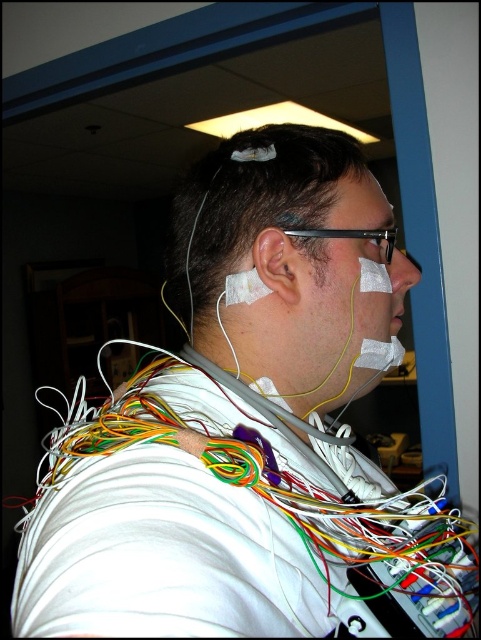
Is matte skin ear at center above white adhesive tape at right?

Incorrect, matte skin ear at center is not positioned above white adhesive tape at right.

The width and height of the screenshot is (481, 640). Identify the location of matte skin ear at center. (275, 264).

I want to click on matte skin ear at center, so click(275, 264).

Does white adhesive tape at center have a lesser height compared to matte skin nose at center?

No, white adhesive tape at center is not shorter than matte skin nose at center.

Find the location of a particular element. The image size is (481, 640). white adhesive tape at center is located at coordinates (287, 259).

What are the coordinates of `white adhesive tape at center` in the screenshot? It's located at (287, 259).

Is white adhesive tape at center bigger than matte skin ear at center?

Yes, white adhesive tape at center is bigger than matte skin ear at center.

Can you confirm if white adhesive tape at center is positioned below matte skin ear at center?

Incorrect, white adhesive tape at center is not positioned below matte skin ear at center.

You are a GUI agent. You are given a task and a screenshot of the screen. Output one action in this format:
    pyautogui.click(x=<x>, y=<y>)
    Task: Click on the white adhesive tape at center
    
    Given the screenshot: What is the action you would take?
    [287, 259]

The height and width of the screenshot is (640, 481). In order to click on white adhesive tape at center in this screenshot , I will do `click(287, 259)`.